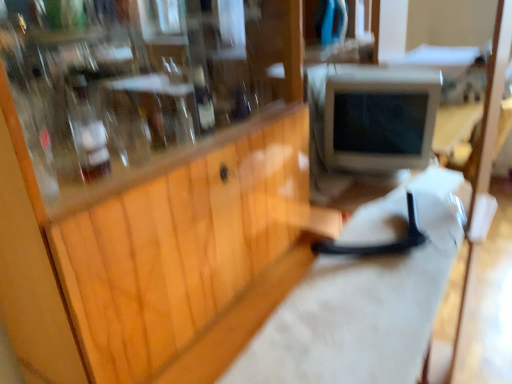
Question: Which direction should I rotate to look at translucent glass bottle at center, which is the second bottle from left to right, — up or down?

Choices:
 (A) down
 (B) up

Answer: (B)

Question: From a real-world perspective, is white plastic computer monitor at center located higher than wooden cabinet at center?

Choices:
 (A) no
 (B) yes

Answer: (B)

Question: Considering the relative positions of white plastic computer monitor at center and wooden cabinet at center in the image provided, is white plastic computer monitor at center to the left of wooden cabinet at center from the viewer's perspective?

Choices:
 (A) yes
 (B) no

Answer: (B)

Question: Is wooden cabinet at center a part of white plastic computer monitor at center?

Choices:
 (A) no
 (B) yes

Answer: (A)

Question: Can you confirm if white plastic computer monitor at center is wider than wooden cabinet at center?

Choices:
 (A) yes
 (B) no

Answer: (B)

Question: Are white plastic computer monitor at center and wooden cabinet at center making contact?

Choices:
 (A) yes
 (B) no

Answer: (B)

Question: Considering the relative sizes of white plastic computer monitor at center and wooden cabinet at center in the image provided, is white plastic computer monitor at center taller than wooden cabinet at center?

Choices:
 (A) no
 (B) yes

Answer: (A)

Question: Are translucent glass bottle at upper left, the second bottle when ordered from back to front, and white plastic computer monitor at center beside each other?

Choices:
 (A) no
 (B) yes

Answer: (A)

Question: Is translucent glass bottle at upper left, the 2th bottle in the right-to-left sequence, bigger than white plastic computer monitor at center?

Choices:
 (A) no
 (B) yes

Answer: (A)

Question: From the image's perspective, is translucent glass bottle at upper left, the second bottle when ordered from back to front, located above white plastic computer monitor at center?

Choices:
 (A) no
 (B) yes

Answer: (A)

Question: Is the depth of translucent glass bottle at upper left, placed as the first bottle when sorted from front to back, greater than that of white plastic computer monitor at center?

Choices:
 (A) no
 (B) yes

Answer: (A)

Question: Considering the relative sizes of translucent glass bottle at upper left, placed as the first bottle when sorted from front to back, and white plastic computer monitor at center in the image provided, is translucent glass bottle at upper left, placed as the first bottle when sorted from front to back, shorter than white plastic computer monitor at center?

Choices:
 (A) no
 (B) yes

Answer: (B)

Question: From a real-world perspective, is translucent glass bottle at upper left, the second bottle when ordered from back to front, positioned under white plastic computer monitor at center based on gravity?

Choices:
 (A) yes
 (B) no

Answer: (B)

Question: Does white matte workbench at center appear on the left side of wooden cabinet at center?

Choices:
 (A) yes
 (B) no

Answer: (B)